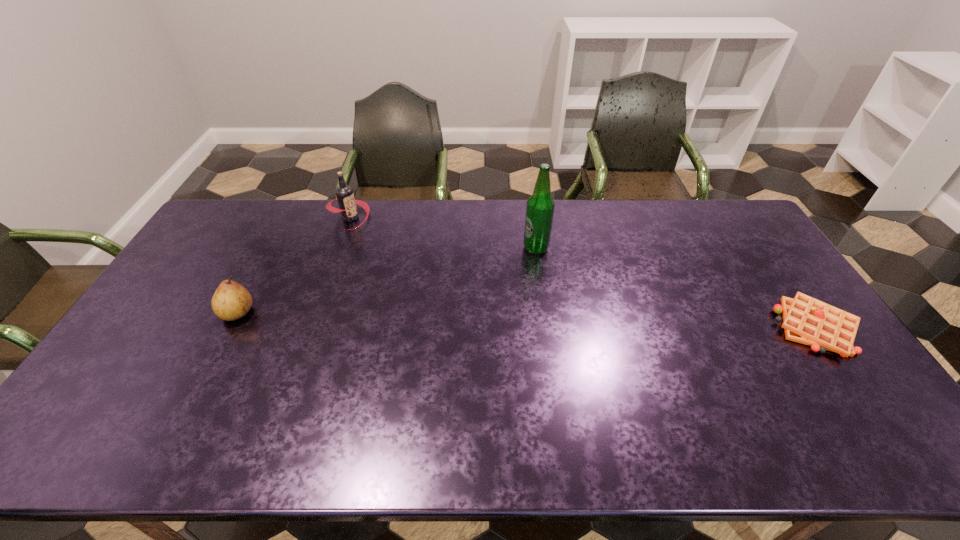
Identify the location of pear. The width and height of the screenshot is (960, 540). (231, 301).

You are a GUI agent. You are given a task and a screenshot of the screen. Output one action in this format:
    pyautogui.click(x=<x>, y=<y>)
    Task: Click on the third tallest object
    This screenshot has width=960, height=540.
    Given the screenshot: What is the action you would take?
    231,301

What are the coordinates of `waffle` in the screenshot? It's located at (806, 320).

This screenshot has height=540, width=960. Identify the location of the shortest object. (806, 320).

This screenshot has height=540, width=960. I want to click on the third object from right to left, so click(x=344, y=193).

The image size is (960, 540). What are the coordinates of `the second tallest object` in the screenshot? It's located at (344, 193).

Locate an element on the screen. Image resolution: width=960 pixels, height=540 pixels. the third nearest object is located at coordinates tap(540, 206).

This screenshot has width=960, height=540. I want to click on beer bottle, so click(540, 206).

You are a GUI agent. You are given a task and a screenshot of the screen. Output one action in this format:
    pyautogui.click(x=<x>, y=<y>)
    Task: Click on the vacant space located on the right of the pear
    
    Given the screenshot: What is the action you would take?
    pyautogui.click(x=370, y=313)

Where is `blank space located on the left of the waffle`? blank space located on the left of the waffle is located at coordinates (689, 328).